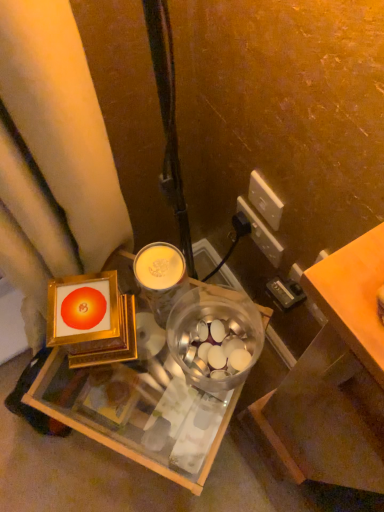
Question: From the image's perspective, is white plastic power outlet at upper right, acting as the 2th power outlet starting from the front, positioned above or below metallic gold frame at center?

Choices:
 (A) above
 (B) below

Answer: (A)

Question: In terms of width, does white plastic power outlet at upper right, acting as the 2th power outlet starting from the front, look wider or thinner when compared to metallic gold frame at center?

Choices:
 (A) thin
 (B) wide

Answer: (A)

Question: Which is nearer to the transparent plastic bowl at center?

Choices:
 (A) white plastic power outlet at upper right, which is the 1th power outlet in front-to-back order
 (B) white plastic power outlet at upper right, acting as the 2th power outlet starting from the front
 (C) gold textured cup at center
 (D) orange matte table at right
 (E) metallic gold frame at center

Answer: (C)

Question: Which object is the farthest from the white plastic power outlet at upper right, acting as the 2th power outlet starting from the front?

Choices:
 (A) transparent plastic bowl at center
 (B) orange matte table at right
 (C) white plastic power outlet at upper right, which is the 1th power outlet in front-to-back order
 (D) metallic gold frame at center
 (E) gold textured cup at center

Answer: (B)